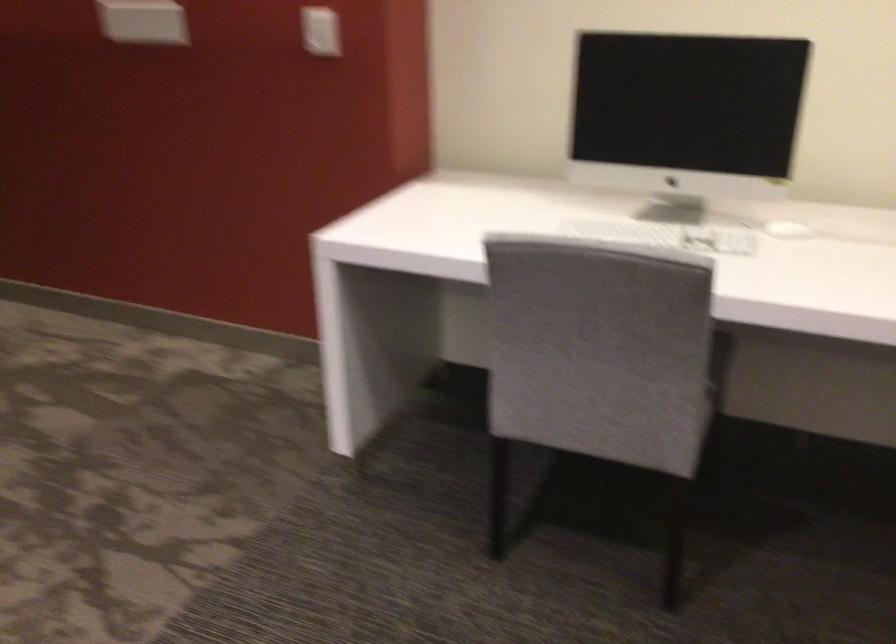
Find the location of a particular element. This screenshot has width=896, height=644. white computer mouse is located at coordinates (786, 230).